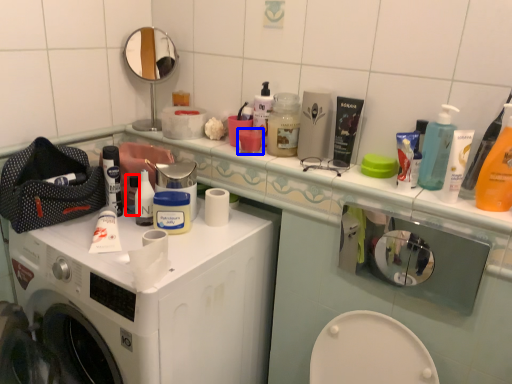
Question: Among these objects, which one is farthest to the camera, toiletry (highlighted by a red box) or mouthwash (highlighted by a blue box)?

Choices:
 (A) toiletry
 (B) mouthwash

Answer: (A)